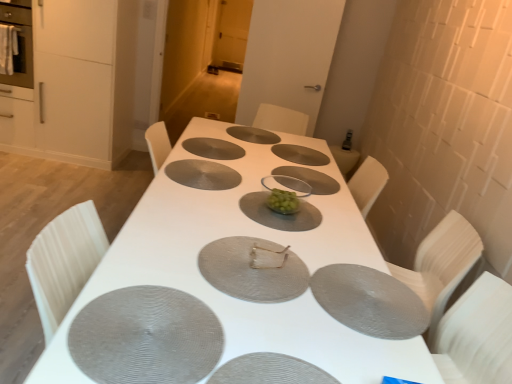
At what (x,y) coordinates should I click in order to perform the action: click on free space above green matte platter at center (from a real-world perspective). Please return your answer as a coordinate pair (x, y). Image resolution: width=512 pixels, height=384 pixels. Looking at the image, I should click on (278, 208).